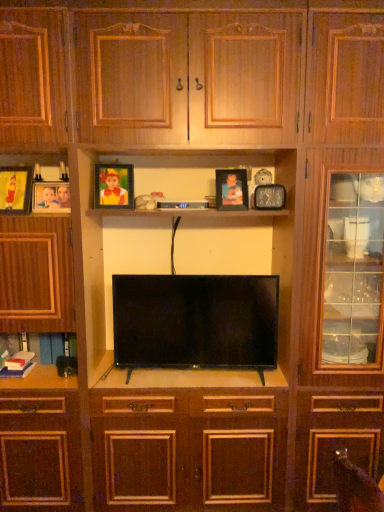
Question: From their relative heights in the image, would you say flat screen tv at center is taller or shorter than matte black picture frame at upper center, arranged as the fourth picture frame when viewed from the left?

Choices:
 (A) tall
 (B) short

Answer: (A)

Question: Considering their positions, is flat screen tv at center located in front of or behind matte black picture frame at upper center, the second picture frame viewed from the right?

Choices:
 (A) front
 (B) behind

Answer: (A)

Question: Considering the real-world distances, which object is closest to the flat screen tv at center?

Choices:
 (A) matte wooden picture frame at left, which is counted as the 4th picture frame, starting from the right
 (B) matte gold picture frame at upper left, which is counted as the third picture frame, starting from the left
 (C) matte black picture frame at upper center, the second picture frame viewed from the right
 (D) matte wooden picture frame at left, which is the fifth picture frame in right-to-left order
 (E) black plastic remote control at center

Answer: (E)

Question: Which object is the farthest from the matte black picture frame at upper center, arranged as the fourth picture frame when viewed from the left?

Choices:
 (A) matte wooden picture frame at left, the 2th picture frame in the left-to-right sequence
 (B) matte gold picture frame at upper left, which is counted as the third picture frame, starting from the left
 (C) matte wooden picture frame at left, arranged as the 1th picture frame when viewed from the left
 (D) black plastic remote control at center
 (E) matte black clock at upper center, the fifth picture frame in the left-to-right sequence

Answer: (C)